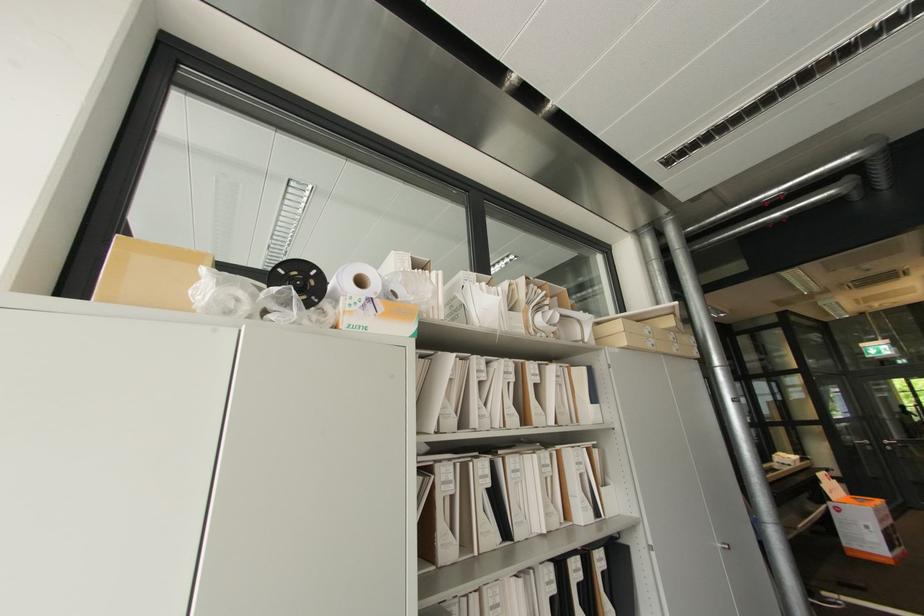
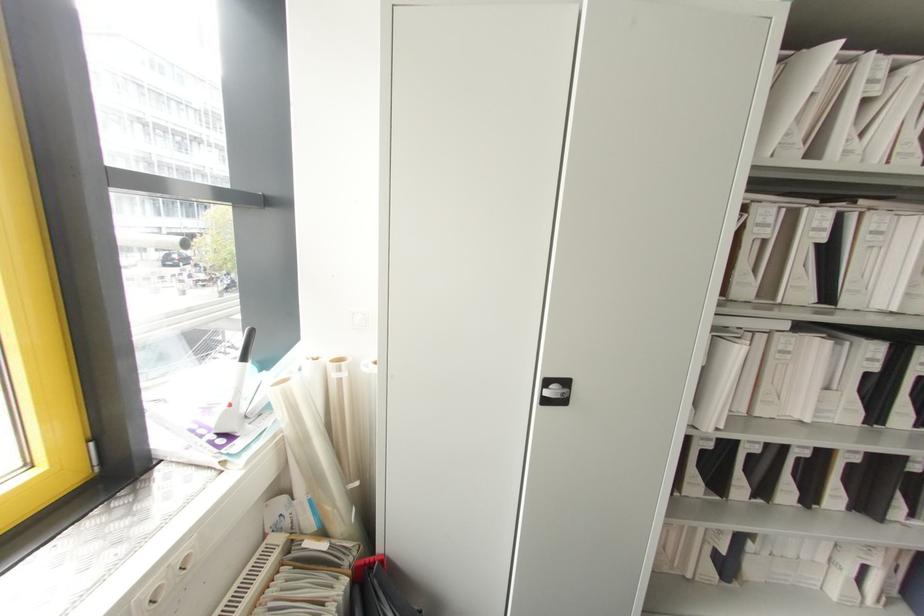
The first image is from the beginning of the video and the second image is from the end. How did the camera likely rotate when shooting the video?

The camera rotated toward left-down.